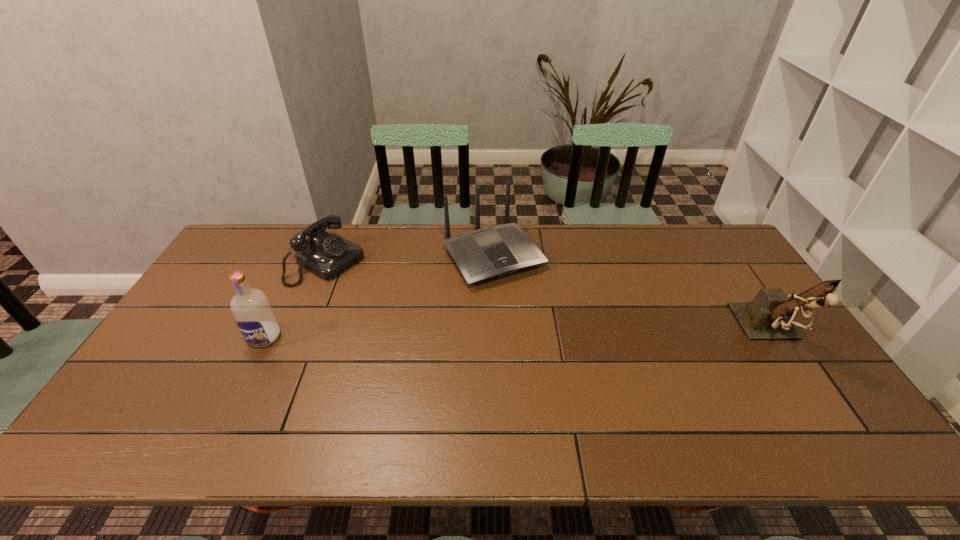
I want to click on vodka, so click(x=250, y=307).

The image size is (960, 540). In order to click on the tallest object in this screenshot , I will do `click(769, 316)`.

Where is `the rightmost object`? This screenshot has height=540, width=960. the rightmost object is located at coordinates (769, 316).

Identify the location of telephone. The height and width of the screenshot is (540, 960). (327, 255).

The width and height of the screenshot is (960, 540). I want to click on the third object from left to right, so click(497, 251).

At what (x,y) coordinates should I click in order to perform the action: click on free location located 0.180m on the label of the vodka. Please return your answer as a coordinate pair (x, y). The width and height of the screenshot is (960, 540). Looking at the image, I should click on (229, 408).

The image size is (960, 540). What are the coordinates of `vacant space located on the front-facing side of the tallest object` in the screenshot? It's located at (816, 403).

Where is `free point located 0.180m on the dial of the telephone`? The height and width of the screenshot is (540, 960). free point located 0.180m on the dial of the telephone is located at coordinates (391, 300).

You are a GUI agent. You are given a task and a screenshot of the screen. Output one action in this format:
    pyautogui.click(x=<x>, y=<y>)
    Task: Click on the free space located 0.380m on the dial of the telephone
    
    Given the screenshot: What is the action you would take?
    pyautogui.click(x=442, y=328)

At what (x,y) coordinates should I click in order to perform the action: click on free region located 0.100m on the dial of the telephone. Please return your answer as a coordinate pair (x, y). This screenshot has width=960, height=540. Looking at the image, I should click on (372, 289).